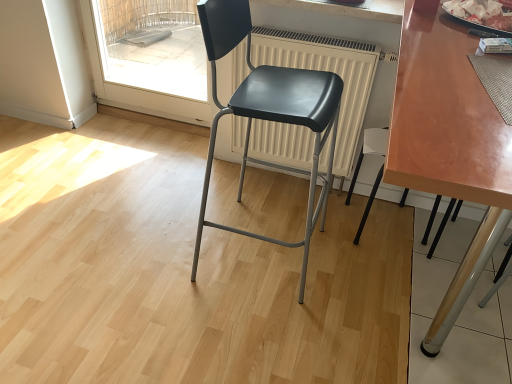
At what (x,y) coordinates should I click in order to perform the action: click on vacant area that is in front of matte black chair at center, which is the 1th chair in left-to-right order. Please return your answer as a coordinate pair (x, y). This screenshot has height=384, width=512. Looking at the image, I should click on (232, 334).